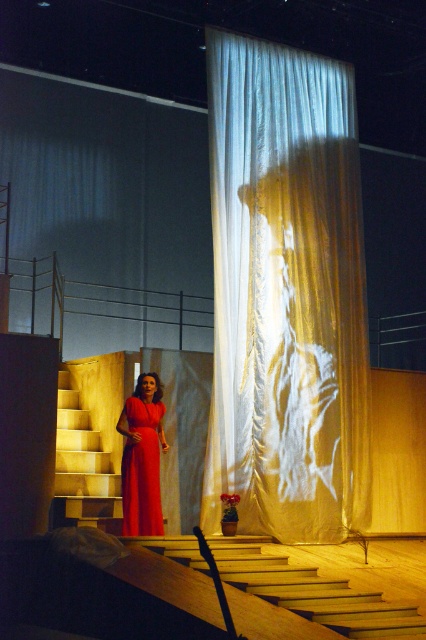
Describe the element at coordinates (316, 588) in the screenshot. The image size is (426, 640). I see `wooden stairs at lower left` at that location.

Can you confirm if wooden stairs at lower left is thinner than matte red dress at center?

No, wooden stairs at lower left is not thinner than matte red dress at center.

Is point (284, 554) in front of point (138, 449)?

Yes, point (284, 554) is in front of point (138, 449).

At what (x,y) coordinates should I click in order to perform the action: click on wooden stairs at lower left. Please return your answer as a coordinate pair (x, y). This screenshot has height=640, width=426. Looking at the image, I should click on (316, 588).

Between wooden stairs at lower left and light wood stairs at lower left, which one appears on the right side from the viewer's perspective?

From the viewer's perspective, wooden stairs at lower left appears more on the right side.

Who is taller, wooden stairs at lower left or light wood stairs at lower left?

With more height is light wood stairs at lower left.

Is point (290, 602) closer to viewer compared to point (104, 492)?

Yes, it is in front of point (104, 492).

Locate an element on the screen. wooden stairs at lower left is located at coordinates (316, 588).

Who is taller, light wood stairs at lower left or matte red dress at center?

light wood stairs at lower left

Locate an element on the screen. This screenshot has height=640, width=426. light wood stairs at lower left is located at coordinates (83, 460).